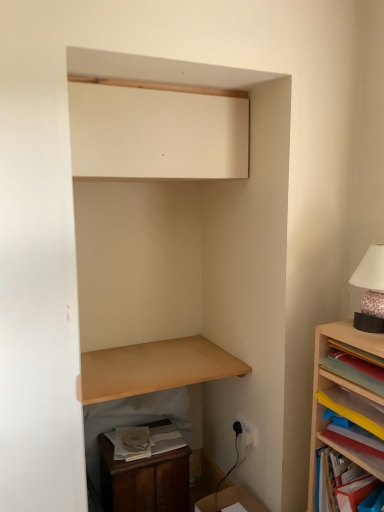
The height and width of the screenshot is (512, 384). I want to click on yellow paper at upper right, placed as the 1th book when sorted from bottom to top, so click(x=349, y=414).

What is the approximate width of wooden dresser at lower left?

The width of wooden dresser at lower left is 11.40 inches.

What do you see at coordinates (339, 482) in the screenshot? I see `wooden bookshelf at lower right, the 2th shelf when ordered from right to left` at bounding box center [339, 482].

What are the coordinates of `matte yellow book at right, which is the 1th book in top-to-bottom order` in the screenshot? It's located at (351, 372).

From the image's perspective, which is above, cardboard box at lower right or white paper at lower left?

white paper at lower left appears higher in the image.

Is the surface of cardboard box at lower right in direct contact with white paper at lower left?

No, cardboard box at lower right is not making contact with white paper at lower left.

Considering the sizes of objects cardboard box at lower right and white paper at lower left in the image provided, who is thinner, cardboard box at lower right or white paper at lower left?

white paper at lower left is thinner.

Is white paper at lower left surrounded by cardboard box at lower right?

No.

Which point is more forward, (381, 291) or (145, 380)?

Point (381, 291)

Which of these two, matte pink lampshade at upper right or light brown wood shelf at lower center, which ranks as the third shelf in right-to-left order, is bigger?

light brown wood shelf at lower center, which ranks as the third shelf in right-to-left order, is bigger.

Is matte pink lampshade at upper right situated inside light brown wood shelf at lower center, which ranks as the third shelf in right-to-left order, or outside?

matte pink lampshade at upper right is not enclosed by light brown wood shelf at lower center, which ranks as the third shelf in right-to-left order.

Between matte pink lampshade at upper right and light brown wood shelf at lower center, which ranks as the third shelf in right-to-left order, which one has less height?

light brown wood shelf at lower center, which ranks as the third shelf in right-to-left order.

From the image's perspective, would you say wooden shelf at right, acting as the 1th shelf starting from the right, is shown under white plastic electric outlet at lower right?

No, from the image's perspective, wooden shelf at right, acting as the 1th shelf starting from the right, is not beneath white plastic electric outlet at lower right.

Is wooden shelf at right, acting as the 1th shelf starting from the right, beside white plastic electric outlet at lower right?

No, wooden shelf at right, acting as the 1th shelf starting from the right, is not with white plastic electric outlet at lower right.

Which object is positioned more to the right, wooden shelf at right, acting as the 1th shelf starting from the right, or white plastic electric outlet at lower right?

wooden shelf at right, acting as the 1th shelf starting from the right, is more to the right.

Between point (204, 498) and point (357, 489), which one is positioned behind?

Point (204, 498)

Looking at this image, measure the distance from cardboard box at lower right to wooden bookshelf at lower right, placed as the second shelf when sorted from left to right.

cardboard box at lower right and wooden bookshelf at lower right, placed as the second shelf when sorted from left to right, are 19.70 inches apart from each other.

Is cardboard box at lower right not near wooden bookshelf at lower right, placed as the second shelf when sorted from left to right?

That's not correct — cardboard box at lower right is a little close to wooden bookshelf at lower right, placed as the second shelf when sorted from left to right.

Does cardboard box at lower right lie behind wooden bookshelf at lower right, the 2th shelf when ordered from right to left?

Yes, it is behind wooden bookshelf at lower right, the 2th shelf when ordered from right to left.

Considering the positions of point (209, 503) and point (141, 353), is point (209, 503) closer or farther from the camera than point (141, 353)?

Point (209, 503) appears to be closer to the viewer than point (141, 353).

From the image's perspective, is cardboard box at lower right above light brown wood shelf at lower center, which ranks as the third shelf in right-to-left order?

Actually, cardboard box at lower right appears below light brown wood shelf at lower center, which ranks as the third shelf in right-to-left order, in the image.

The width and height of the screenshot is (384, 512). What are the coordinates of `the 3rd shelf directly above the cardboard box at lower right (from a real-world perspective)` in the screenshot? It's located at (153, 368).

Is wooden bookshelf at lower right, the 2th shelf when ordered from right to left, not inside wooden shelf at right, positioned as the 3th shelf in left-to-right order?

No, wooden bookshelf at lower right, the 2th shelf when ordered from right to left, is not outside of wooden shelf at right, positioned as the 3th shelf in left-to-right order.

Which of these two, wooden bookshelf at lower right, the 2th shelf when ordered from right to left, or wooden shelf at right, acting as the 1th shelf starting from the right, is thinner?

Thinner between the two is wooden bookshelf at lower right, the 2th shelf when ordered from right to left.

Image resolution: width=384 pixels, height=512 pixels. In order to click on shelf that is the 1st object located behind the wooden shelf at right, acting as the 1th shelf starting from the right in this screenshot , I will do `click(339, 482)`.

Is wooden bookshelf at lower right, the 2th shelf when ordered from right to left, next to wooden shelf at right, acting as the 1th shelf starting from the right, and touching it?

wooden bookshelf at lower right, the 2th shelf when ordered from right to left, and wooden shelf at right, acting as the 1th shelf starting from the right, are not in contact.

From a real-world perspective, which is physically below, white plastic electric outlet at lower right or matte white cabinet at upper center?

white plastic electric outlet at lower right is physically lower.

How different are the orientations of white plastic electric outlet at lower right and matte white cabinet at upper center in degrees?

They differ by 86 degrees in their facing directions.

From the image's perspective, between white plastic electric outlet at lower right and matte white cabinet at upper center, who is located below?

From the image's view, white plastic electric outlet at lower right is below.

In order to click on paperback book that is above the cardboard box at lower right (from the image's perspective) in this screenshot , I will do `click(145, 441)`.

Identify the location of table lamp in front of the light brown wood shelf at lower center, acting as the first shelf starting from the left. (370, 290).

Based on their spatial positions, is cardboard box at lower right or white paper at lower left closer to wooden bookshelf at lower right, placed as the second shelf when sorted from left to right?

cardboard box at lower right is positioned closer to the anchor wooden bookshelf at lower right, placed as the second shelf when sorted from left to right.

Which object lies further to the anchor point wooden bookshelf at lower right, the 2th shelf when ordered from right to left, wooden dresser at lower left or matte yellow book at right, which is the 1th book in top-to-bottom order?

wooden dresser at lower left is positioned further to the anchor wooden bookshelf at lower right, the 2th shelf when ordered from right to left.

When comparing their distances from matte pink lampshade at upper right, does wooden dresser at lower left or light brown wood shelf at lower center, which ranks as the third shelf in right-to-left order, seem closer?

The object closer to matte pink lampshade at upper right is light brown wood shelf at lower center, which ranks as the third shelf in right-to-left order.

Considering their positions, is matte white cabinet at upper center positioned closer to cardboard box at lower right than white plastic electric outlet at lower right?

Based on the image, white plastic electric outlet at lower right appears to be nearer to cardboard box at lower right.

Considering their positions, is cardboard box at lower right positioned closer to matte pink lampshade at upper right than wooden dresser at lower left?

cardboard box at lower right.

Estimate the real-world distances between objects in this image. Which object is further from light brown wood shelf at lower center, acting as the first shelf starting from the left, matte pink lampshade at upper right or white plastic electric outlet at lower right?

matte pink lampshade at upper right is further to light brown wood shelf at lower center, acting as the first shelf starting from the left.

Which object lies nearer to the anchor point matte white cabinet at upper center, wooden dresser at lower left or yellow paper at upper right, acting as the second book starting from the top?

yellow paper at upper right, acting as the second book starting from the top, is positioned closer to the anchor matte white cabinet at upper center.

From the image, which object appears to be farther from matte white cabinet at upper center, matte yellow book at right, which is the 1th book in top-to-bottom order, or wooden bookshelf at lower right, placed as the second shelf when sorted from left to right?

Among the two, wooden bookshelf at lower right, placed as the second shelf when sorted from left to right, is located further to matte white cabinet at upper center.

Image resolution: width=384 pixels, height=512 pixels. Identify the location of cardboard box positioned between wooden bookshelf at lower right, the 2th shelf when ordered from right to left, and white plastic electric outlet at lower right from near to far. (230, 501).

At what (x,y) coordinates should I click in order to perform the action: click on book located between white paper at lower left and matte pink lampshade at upper right in the left-right direction. Please return your answer as a coordinate pair (x, y). Looking at the image, I should click on (349, 414).

At what (x,y) coordinates should I click in order to perform the action: click on electric outlet situated between light brown wood shelf at lower center, acting as the first shelf starting from the left, and matte pink lampshade at upper right from left to right. Please return your answer as a coordinate pair (x, y). The height and width of the screenshot is (512, 384). Looking at the image, I should click on (248, 431).

What are the coordinates of `cardboard box between white paper at lower left and white plastic electric outlet at lower right` in the screenshot? It's located at (230, 501).